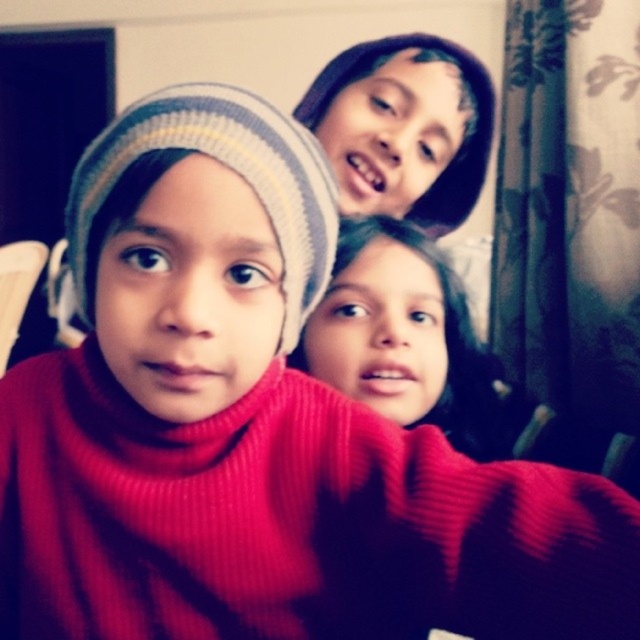
Consider the image. What are the coordinates of the striped knit beanie at center in the image?

The striped knit beanie at center is located at coordinates (228, 168).

You are a photographer adjusting the camera focus. You need to ensure both the striped knit beanie at center and the matte black beanie at upper center are in focus. Which beanie should you focus on first to achieve this?

The striped knit beanie at center is not as tall as matte black beanie at upper center, so focusing on the matte black beanie at upper center first would help ensure both are in focus.